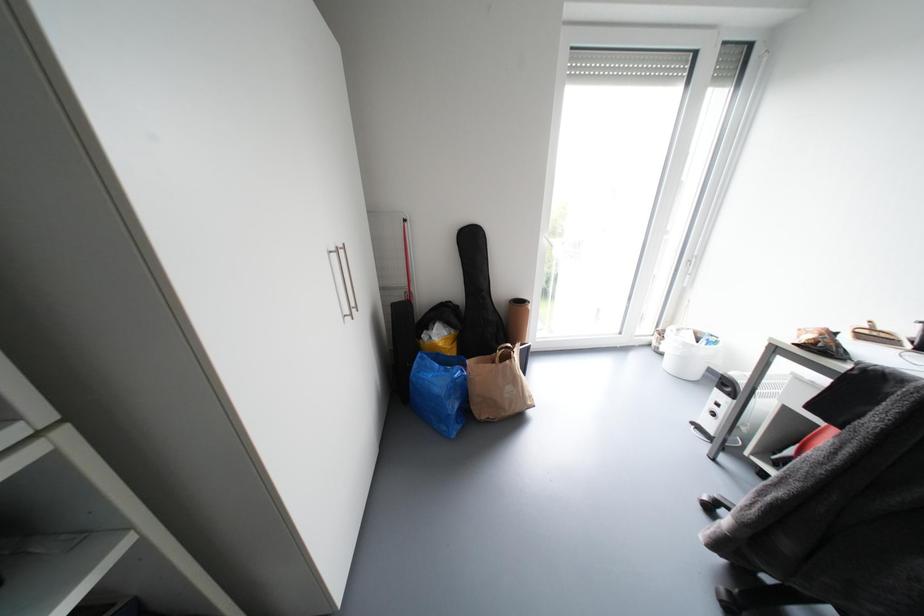
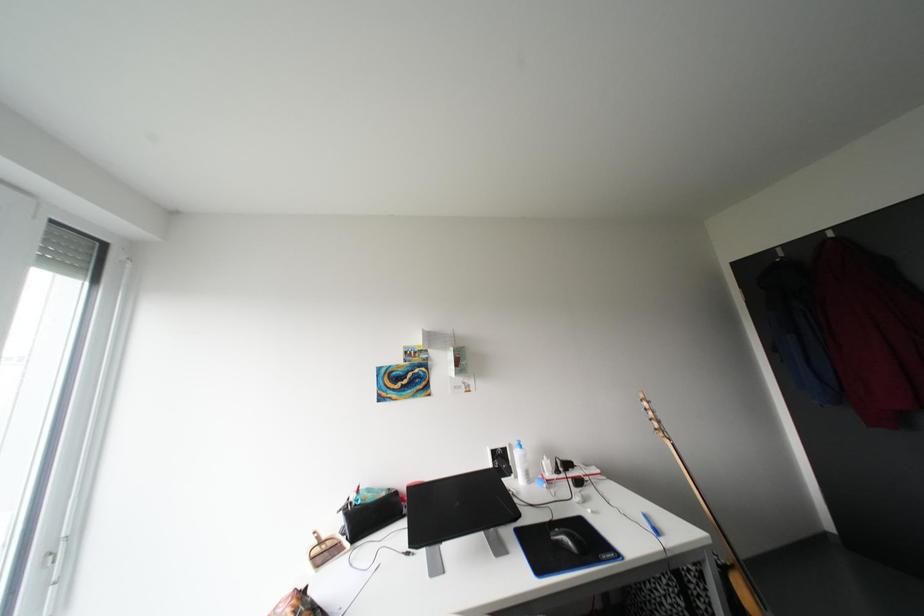
Question: Based on the continuous images, in which direction is the camera rotating? Reply with the corresponding letter.

Choices:
 (A) Left
 (B) Right
 (C) Up
 (D) Down

Answer: (B)